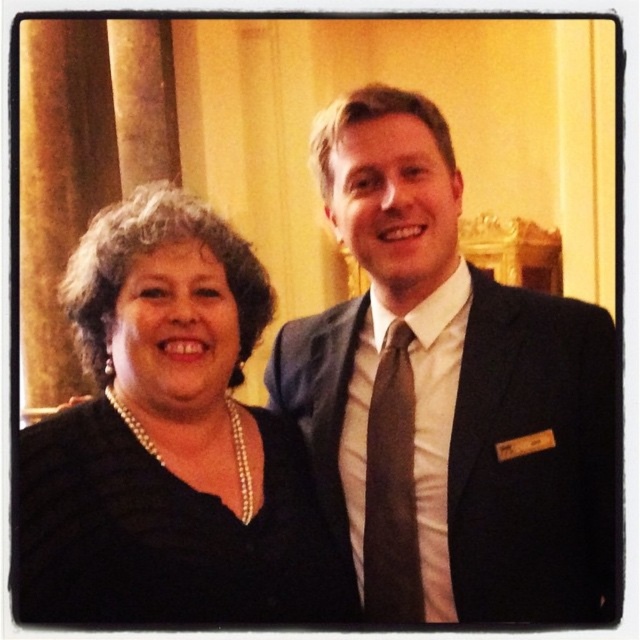
You are an event planner organizing a photoshoot and need to position a matte black suit at center. According to the scene description, where should you place the matte black suit in relation to the other objects?

The matte black suit at center should be placed at point coordinates (448, 394) as specified in the Objects Description.

You are a photographer adjusting your camera settings to capture the details of the matte black suit at center and the brown silk tie at center. Which object will appear larger in the photo due to its proximity to the camera?

The matte black suit at center will appear larger in the photo because it is closer to the viewer than the brown silk tie at center.